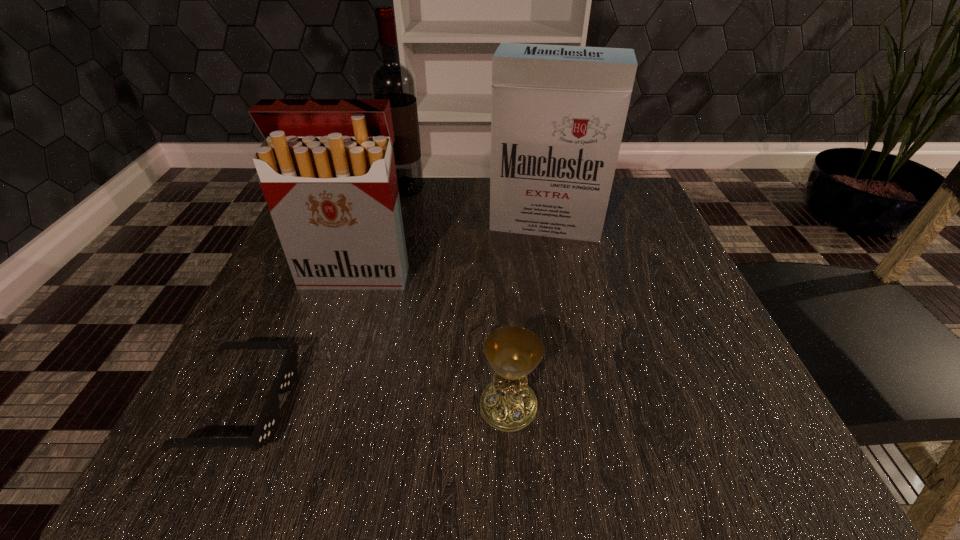
I want to click on vacant region that satisfies the following two spatial constraints: 1. on the front side of the farther cigarette case; 2. on the front-facing side of the sunglasses, so click(581, 404).

Find the location of a particular element. free spot that satisfies the following two spatial constraints: 1. with the lid open on the left cigarette case; 2. on the front-facing side of the shortest object is located at coordinates (314, 404).